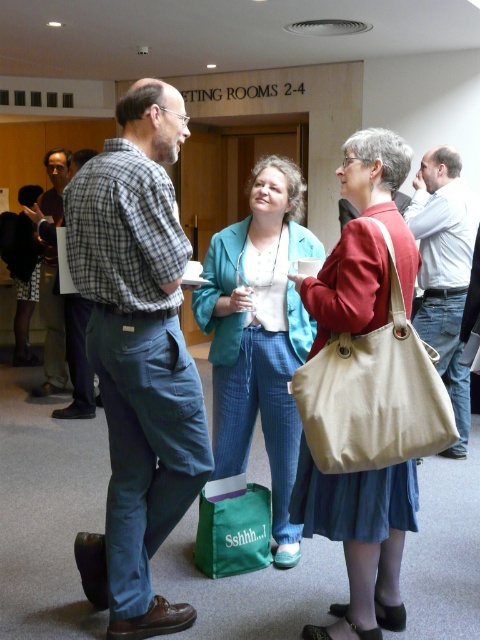
Which of these two, light blue jeans at center or plaid shirt at left, stands taller?

plaid shirt at left is taller.

Who is more distant from viewer, (419, 189) or (49, 328)?

The point (49, 328) is more distant.

Locate an element on the screen. The width and height of the screenshot is (480, 640). light blue jeans at center is located at coordinates (444, 272).

Does canvas tote bag at center appear under plaid shirt at left?

Correct, canvas tote bag at center is located below plaid shirt at left.

Who is more forward, (394, 556) or (59, 292)?

Point (394, 556) is in front.

What do you see at coordinates (360, 538) in the screenshot?
I see `canvas tote bag at center` at bounding box center [360, 538].

Identify the location of canvas tote bag at center. click(x=360, y=538).

Is teal fabric jacket at center thinner than plaid shirt at left?

Correct, teal fabric jacket at center's width is less than plaid shirt at left's.

Who is more forward, (239, 381) or (45, 312)?

Positioned in front is point (239, 381).

Which is behind, point (226, 320) or point (66, 179)?

The point (66, 179) is more distant.

Where is `teal fabric jacket at center`? teal fabric jacket at center is located at coordinates (260, 336).